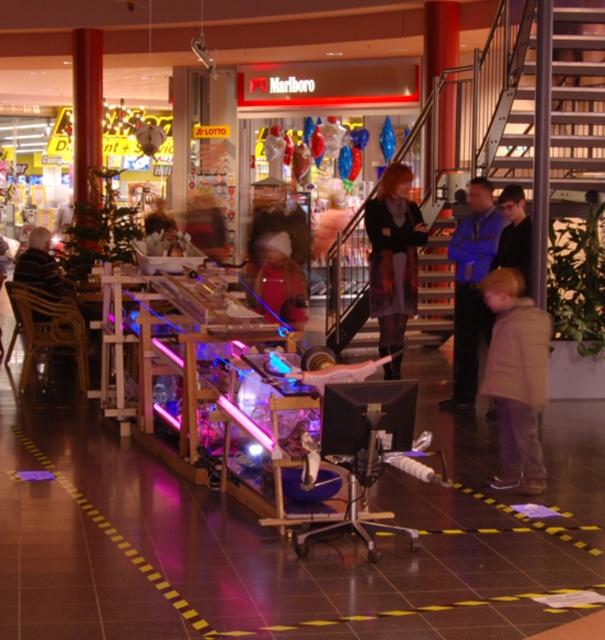
You are organizing a charity clothing drive and need to pack these items into a small box. Given the space constraints, which item would you prioritize packing first between the light brown wool coat at lower right and the striped sweater at left?

The light brown wool coat at lower right occupies less space than the striped sweater at left, so it should be prioritized for packing first into the small box.

You are at the shopping mall and see a gray wool coat at center and a blue fabric jacket at center. Which clothing item is positioned higher?

The gray wool coat at center is positioned higher than the blue fabric jacket at center.

You are trying to decide which coat to take with you. The light brown wool coat at lower right and the blue fabric jacket at center are both available. Which one is narrower?

The light brown wool coat at lower right is narrower than the blue fabric jacket at center.